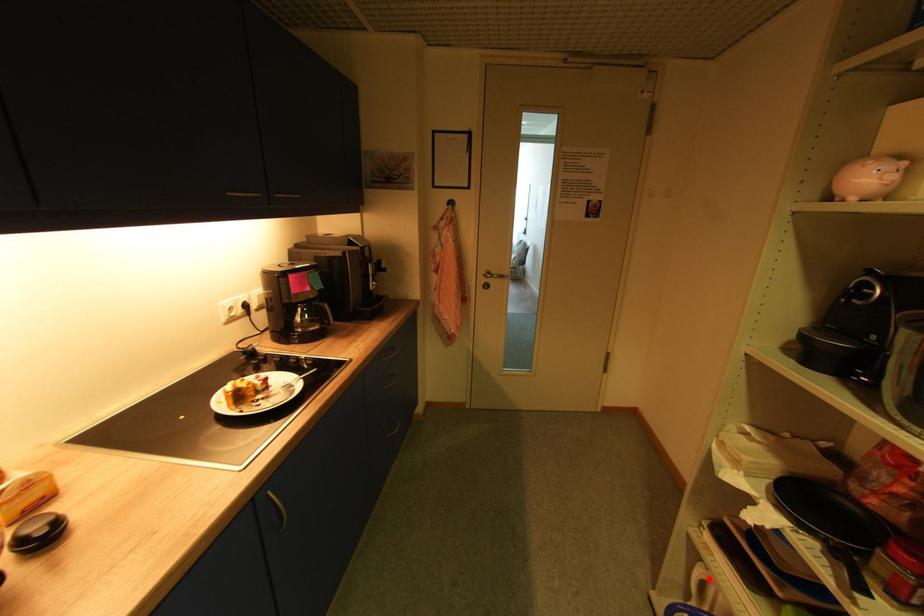
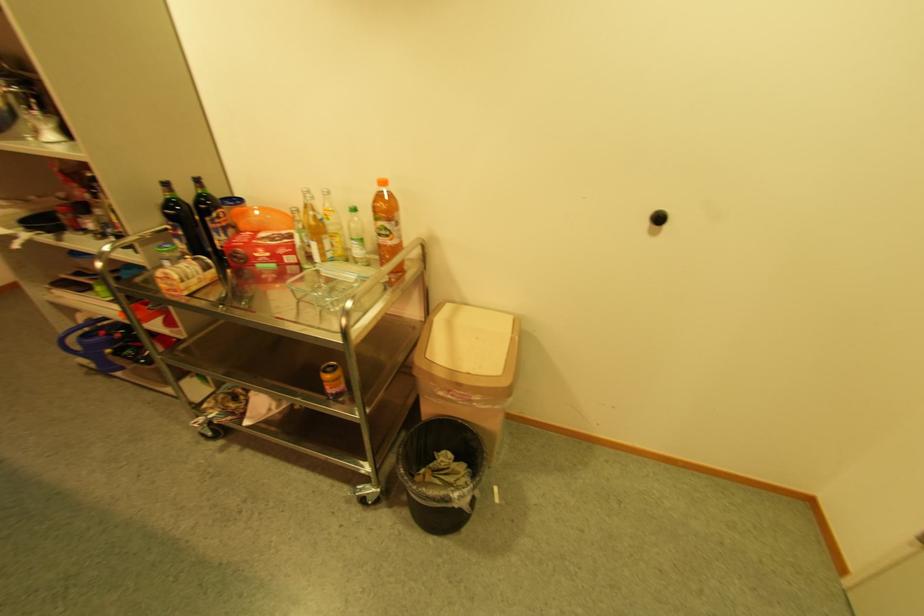
Locate, in the second image, the point that corresponds to the highlighted location in the first image.

(91, 320)